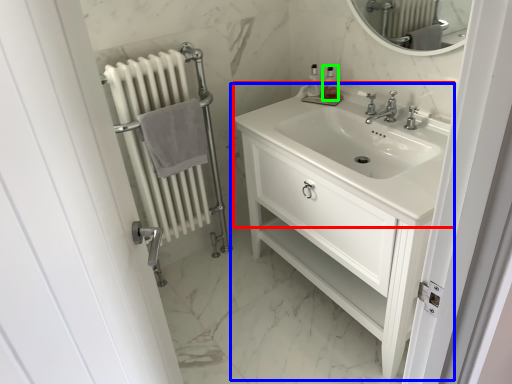
Question: Which object is the closest to the sink (highlighted by a red box)? Choose among these: bathroom cabinet (highlighted by a blue box) or soap dispenser (highlighted by a green box).

Choices:
 (A) bathroom cabinet
 (B) soap dispenser

Answer: (A)